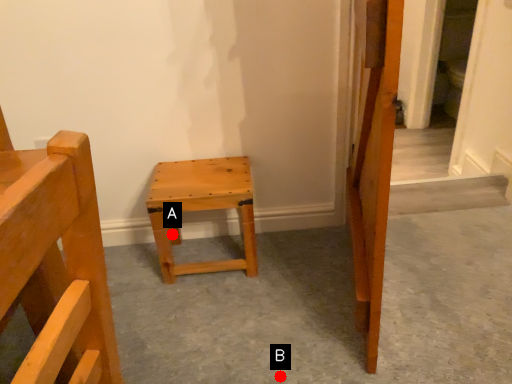
Question: Two points are circled on the image, labeled by A and B beside each circle. Which point appears closest to the camera in this image?

Choices:
 (A) A is closer
 (B) B is closer

Answer: (B)